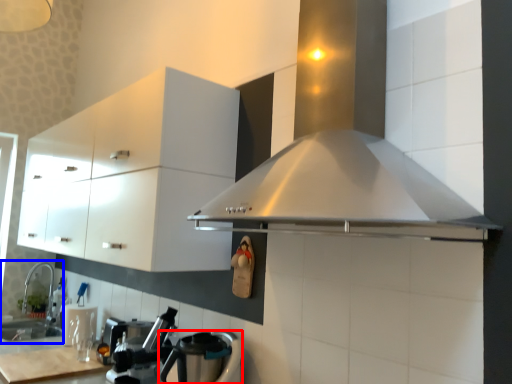
Question: Among these objects, which one is farthest to the camera, kitchen appliance (highlighted by a red box) or sink (highlighted by a blue box)?

Choices:
 (A) kitchen appliance
 (B) sink

Answer: (B)